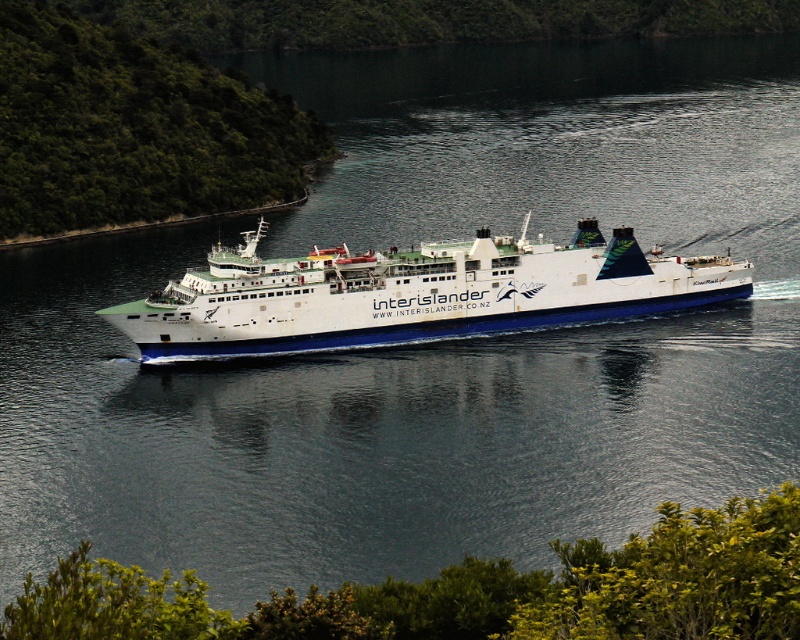
Who is shorter, green leafy shrub at lower center or green leafy trees at upper left?

green leafy shrub at lower center

Does green leafy shrub at lower center have a greater width compared to green leafy trees at upper left?

No.

This screenshot has width=800, height=640. What do you see at coordinates (476, 592) in the screenshot?
I see `green leafy shrub at lower center` at bounding box center [476, 592].

At what (x,y) coordinates should I click in order to perform the action: click on green leafy shrub at lower center. Please return your answer as a coordinate pair (x, y). Looking at the image, I should click on (476, 592).

Can you confirm if green leafy shrub at lower center is smaller than white matte ferry at center?

Correct, green leafy shrub at lower center occupies less space than white matte ferry at center.

Does green leafy shrub at lower center appear over white matte ferry at center?

No, green leafy shrub at lower center is not above white matte ferry at center.

Does point (542, 609) come farther from viewer compared to point (672, 266)?

No, (542, 609) is in front of (672, 266).

Identify the location of green leafy shrub at lower center. (476, 592).

Between green leafy trees at upper left and white matte ferry at center, which one is positioned higher?

green leafy trees at upper left

Locate an element on the screen. green leafy trees at upper left is located at coordinates (134, 128).

Which is behind, point (100, 86) or point (284, 321)?

Point (100, 86)

Find the location of a particular element. The image size is (800, 640). green leafy trees at upper left is located at coordinates (134, 128).